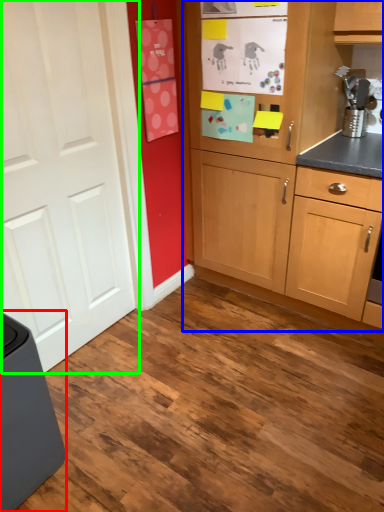
Question: Which object is the farthest from home appliance (highlighted by a red box)? Choose among these: cabinetry (highlighted by a blue box) or door (highlighted by a green box).

Choices:
 (A) cabinetry
 (B) door

Answer: (A)